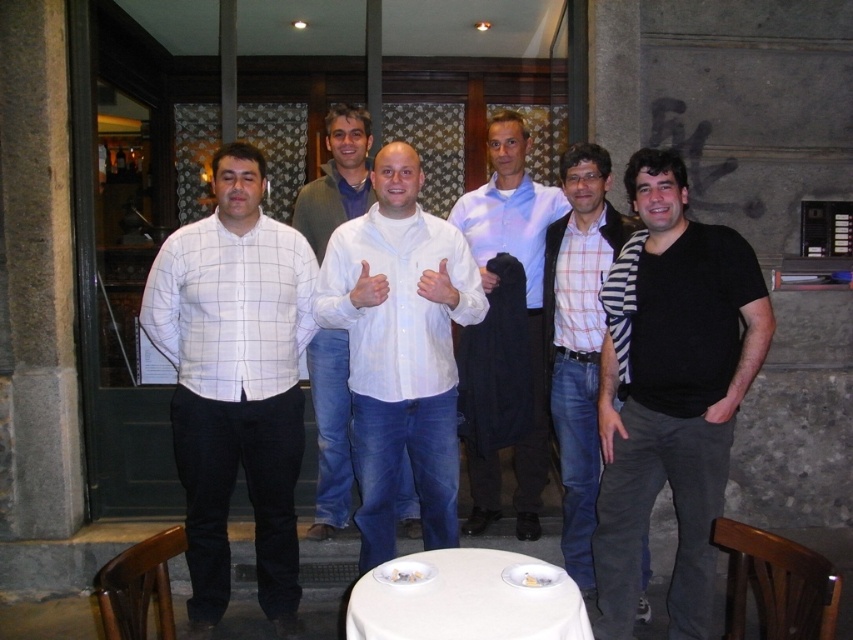
Does white shirt at center appear under white checkered shirt at center?

No.

Which is in front, point (468, 262) or point (579, 269)?

Point (468, 262)

Locate an element on the screen. The image size is (853, 640). white shirt at center is located at coordinates (399, 349).

Who is shorter, white shirt at center or white cloth table at center?

Standing shorter between the two is white cloth table at center.

Is point (357, 342) closer to viewer compared to point (544, 618)?

No, it is not.

The height and width of the screenshot is (640, 853). What are the coordinates of `white shirt at center` in the screenshot? It's located at (399, 349).

Find the location of `black matte shirt at right`. black matte shirt at right is located at coordinates click(674, 396).

Locate an element on the screen. The width and height of the screenshot is (853, 640). black matte shirt at right is located at coordinates (674, 396).